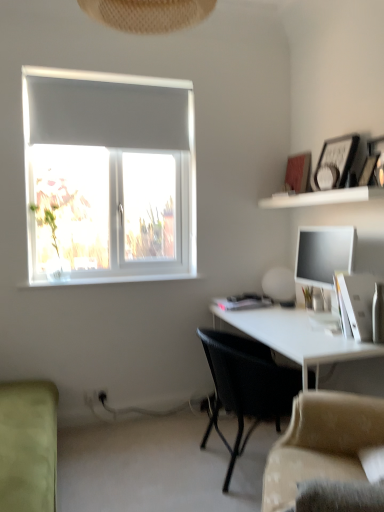
Identify the location of wooden picture frame at upper right. This screenshot has height=512, width=384. (335, 162).

Measure the distance between white glossy table lamp at upper right and camera.

white glossy table lamp at upper right and camera are 9.08 feet apart.

What is the approximate width of white glossy desk at lower right?

The width of white glossy desk at lower right is 24.57 inches.

Image resolution: width=384 pixels, height=512 pixels. Find the location of `white glossy desk at lower right`. white glossy desk at lower right is located at coordinates (296, 337).

In the scene shown: What is the approximate height of satin black monitor at right?

satin black monitor at right is 20.53 inches in height.

The image size is (384, 512). What do you see at coordinates (321, 443) in the screenshot? I see `beige fabric couch at lower right, which ranks as the 2th studio couch in left-to-right order` at bounding box center [321, 443].

Find the location of a particular element. The image size is (384, 512). light green fabric couch at lower left, which is the first studio couch from left to right is located at coordinates (28, 446).

Find the location of a particular element. This screenshot has height=512, width=384. wooden picture frame at upper right is located at coordinates (335, 162).

Does beige fabric couch at lower right, arranged as the first studio couch when viewed from the right, have a lesser width compared to satin black monitor at right?

No.

There is a satin black monitor at right. Where is `the 1st studio couch below it (from a real-world perspective)`? The image size is (384, 512). the 1st studio couch below it (from a real-world perspective) is located at coordinates (321, 443).

Does beige fabric couch at lower right, which ranks as the 2th studio couch in left-to-right order, turn towards satin black monitor at right?

No, beige fabric couch at lower right, which ranks as the 2th studio couch in left-to-right order, is not turned towards satin black monitor at right.

Considering the positions of objects beige fabric couch at lower right, arranged as the first studio couch when viewed from the right, and satin black monitor at right in the image provided, who is behind, beige fabric couch at lower right, arranged as the first studio couch when viewed from the right, or satin black monitor at right?

satin black monitor at right is further away from the camera.

Is black woven chair at center to the left of white glossy shelf at upper right from the viewer's perspective?

Indeed, black woven chair at center is positioned on the left side of white glossy shelf at upper right.

From a real-world perspective, is black woven chair at center over white glossy shelf at upper right?

Actually, black woven chair at center is physically below white glossy shelf at upper right in the real world.

From the image's perspective, does black woven chair at center appear lower than white glossy shelf at upper right?

Yes.

From a real-world perspective, who is located lower, wooden picture frame at upper right or white glossy table lamp at upper right?

white glossy table lamp at upper right.

Considering the sizes of objects wooden picture frame at upper right and white glossy table lamp at upper right in the image provided, who is taller, wooden picture frame at upper right or white glossy table lamp at upper right?

wooden picture frame at upper right.

From the picture: Is wooden picture frame at upper right positioned far away from white glossy table lamp at upper right?

wooden picture frame at upper right is near white glossy table lamp at upper right, not far away.

Is white glossy shelf at upper right not close to white glossy desk at lower right?

They are positioned close to each other.

Considering the points (361, 200) and (351, 341), which point is behind, point (361, 200) or point (351, 341)?

The point (361, 200) is farther.

Does white glossy shelf at upper right have a greater height compared to white glossy desk at lower right?

In fact, white glossy shelf at upper right may be shorter than white glossy desk at lower right.

Is white glossy shelf at upper right facing away from white glossy desk at lower right?

No, white glossy desk at lower right is not at the back of white glossy shelf at upper right.

Is light green fabric couch at lower left, which is the 2th studio couch in right-to-left order, inside or outside of white glossy table lamp at upper right?

light green fabric couch at lower left, which is the 2th studio couch in right-to-left order, cannot be found inside white glossy table lamp at upper right.

How many degrees apart are the facing directions of light green fabric couch at lower left, which is the first studio couch from left to right, and white glossy table lamp at upper right?

The angle between the facing direction of light green fabric couch at lower left, which is the first studio couch from left to right, and the facing direction of white glossy table lamp at upper right is 179 degrees.

From a real-world perspective, is light green fabric couch at lower left, which is the first studio couch from left to right, over white glossy table lamp at upper right?

Actually, light green fabric couch at lower left, which is the first studio couch from left to right, is physically below white glossy table lamp at upper right in the real world.

Is light green fabric couch at lower left, which is the 2th studio couch in right-to-left order, turned away from white glossy table lamp at upper right?

No.

Identify the location of chair that appears behind the beige fabric couch at lower right, which ranks as the 2th studio couch in left-to-right order. (246, 386).

Who is more distant, black woven chair at center or beige fabric couch at lower right, which ranks as the 2th studio couch in left-to-right order?

black woven chair at center is behind.

Who is bigger, black woven chair at center or beige fabric couch at lower right, which ranks as the 2th studio couch in left-to-right order?

black woven chair at center.

Is black woven chair at center with beige fabric couch at lower right, arranged as the first studio couch when viewed from the right?

black woven chair at center is not next to beige fabric couch at lower right, arranged as the first studio couch when viewed from the right, and they're not touching.

Based on the photo, is wooden picture frame at upper right not inside black woven chair at center?

wooden picture frame at upper right is positioned outside black woven chair at center.

Is point (348, 157) behind point (230, 391)?

Yes, point (348, 157) is farther from viewer.

Is wooden picture frame at upper right at the right side of black woven chair at center?

Yes.

From the image's perspective, is wooden picture frame at upper right above black woven chair at center?

Indeed, from the image's perspective, wooden picture frame at upper right is shown above black woven chair at center.

There is a satin black monitor at right. Identify the location of the 1st studio couch below it (from a real-world perspective). (321, 443).

This screenshot has width=384, height=512. What are the coordinates of `shelf behind the black woven chair at center` in the screenshot? It's located at (322, 197).

Consider the image. Estimate the real-world distances between objects in this image. Which object is further from black woven chair at center, satin black monitor at right or light green fabric couch at lower left, which is the 2th studio couch in right-to-left order?

Based on the image, light green fabric couch at lower left, which is the 2th studio couch in right-to-left order, appears to be further to black woven chair at center.

When comparing their distances from white glossy table lamp at upper right, does white glossy desk at lower right or white glossy shelf at upper right seem closer?

white glossy desk at lower right is closer to white glossy table lamp at upper right.

Which object lies further to the anchor point beige fabric couch at lower right, which ranks as the 2th studio couch in left-to-right order, white glossy shelf at upper right or black woven chair at center?

Based on the image, white glossy shelf at upper right appears to be further to beige fabric couch at lower right, which ranks as the 2th studio couch in left-to-right order.

Estimate the real-world distances between objects in this image. Which object is further from satin black monitor at right, white glossy desk at lower right or beige fabric couch at lower right, which ranks as the 2th studio couch in left-to-right order?

Based on the image, beige fabric couch at lower right, which ranks as the 2th studio couch in left-to-right order, appears to be further to satin black monitor at right.

Consider the image. Which object lies further to the anchor point light green fabric couch at lower left, which is the 2th studio couch in right-to-left order, black woven chair at center or beige fabric couch at lower right, which ranks as the 2th studio couch in left-to-right order?

beige fabric couch at lower right, which ranks as the 2th studio couch in left-to-right order, is further to light green fabric couch at lower left, which is the 2th studio couch in right-to-left order.

Looking at the image, which one is located further to wooden picture frame at upper right, satin black monitor at right or white glossy shelf at upper right?

The object further to wooden picture frame at upper right is satin black monitor at right.

Estimate the real-world distances between objects in this image. Which object is further from black woven chair at center, light green fabric couch at lower left, which is the 2th studio couch in right-to-left order, or wooden picture frame at upper right?

Among the two, wooden picture frame at upper right is located further to black woven chair at center.

Which object lies nearer to the anchor point white glossy shelf at upper right, wooden picture frame at upper right or white glossy table lamp at upper right?

wooden picture frame at upper right lies closer to white glossy shelf at upper right than the other object.

The image size is (384, 512). Find the location of `shelf positioned between beige fabric couch at lower right, arranged as the first studio couch when viewed from the right, and wooden picture frame at upper right from near to far`. shelf positioned between beige fabric couch at lower right, arranged as the first studio couch when viewed from the right, and wooden picture frame at upper right from near to far is located at coordinates (322, 197).

Image resolution: width=384 pixels, height=512 pixels. I want to click on desk positioned between beige fabric couch at lower right, which ranks as the 2th studio couch in left-to-right order, and black woven chair at center from near to far, so click(296, 337).

Locate an element on the screen. This screenshot has height=512, width=384. desk between satin black monitor at right and black woven chair at center from top to bottom is located at coordinates (296, 337).

Locate an element on the screen. desk that lies between wooden picture frame at upper right and black woven chair at center from top to bottom is located at coordinates (296, 337).